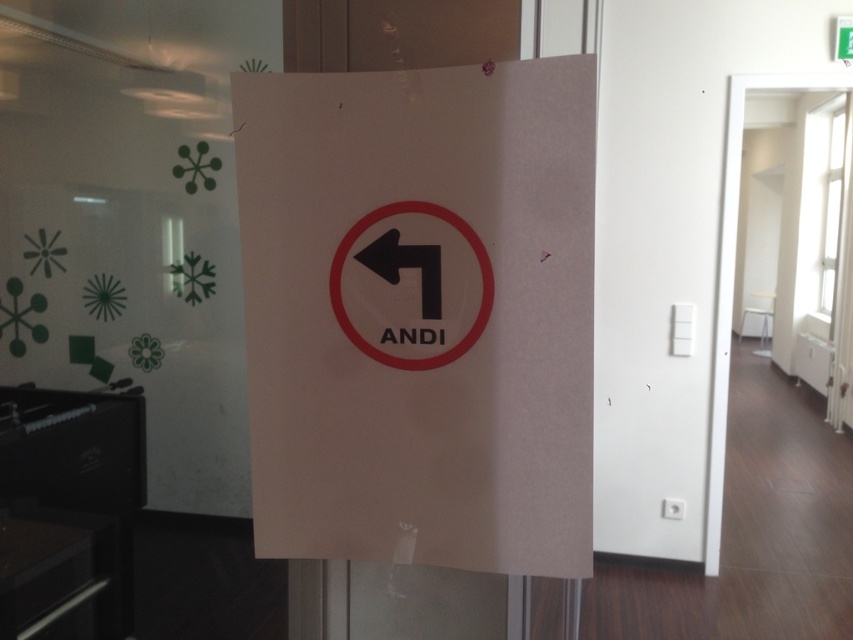
You are standing in front of the glass door with the sign. There is a point at coordinates (479,272). What object is located at that point?

The point at coordinates (479,272) indicates the black plastic sign at center.

You are standing in front of the glass door with the sign. There is a point at coordinates (479, 272). What object is located at that point?

The point at coordinates (479, 272) indicates the black plastic sign at center.